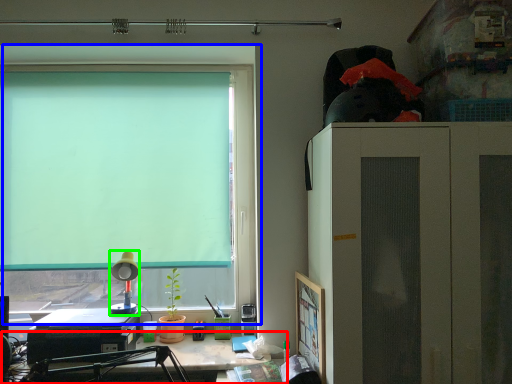
Question: Estimate the real-world distances between objects in this image. Which object is farther from desk (highlighted by a red box), window (highlighted by a blue box) or lamp (highlighted by a green box)?

Choices:
 (A) window
 (B) lamp

Answer: (A)